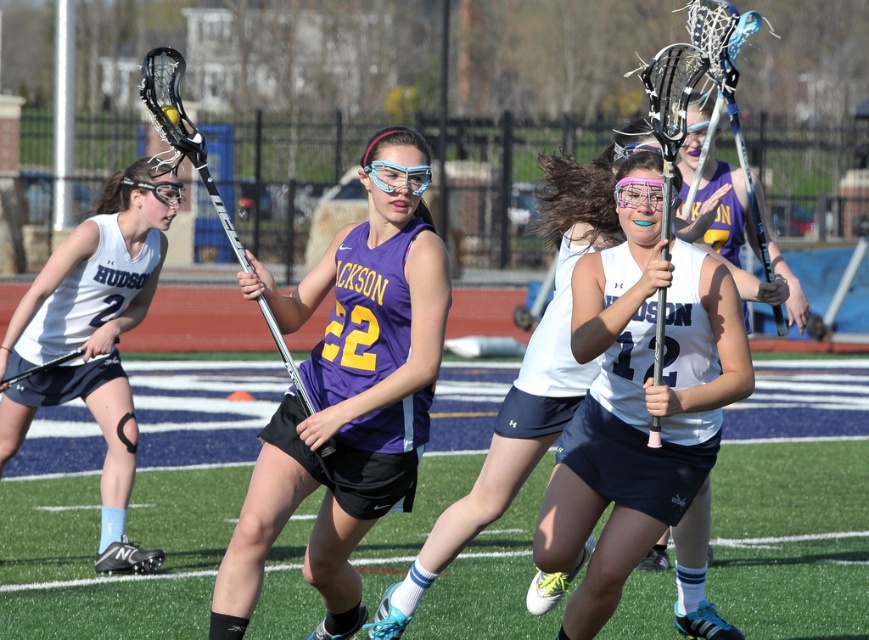
What do you see at coordinates (635, 413) in the screenshot? This screenshot has height=640, width=869. I see `white matte jersey at center` at bounding box center [635, 413].

Between point (731, 394) and point (634, 195), which one is positioned in front?

Point (731, 394) is in front.

Locate an element on the screen. The height and width of the screenshot is (640, 869). white matte jersey at center is located at coordinates (635, 413).

Who is shorter, transparent plastic goggles at center or clear plastic goggles at center?

transparent plastic goggles at center is shorter.

Is point (408, 186) farther from viewer compared to point (144, 186)?

No, (408, 186) is closer to viewer.

You are a GUI agent. You are given a task and a screenshot of the screen. Output one action in this format:
    pyautogui.click(x=<x>, y=<y>)
    Task: Click on the transparent plastic goggles at center
    
    Given the screenshot: What is the action you would take?
    click(x=397, y=177)

Who is shorter, purple matte lacrosse stick at center or white matte uniform at left?

purple matte lacrosse stick at center is shorter.

Who is more forward, (379, 342) or (116, 547)?

Positioned in front is point (379, 342).

Does point (410, 464) lie behind point (125, 388)?

No.

Where is `purple matte lacrosse stick at center`? The height and width of the screenshot is (640, 869). purple matte lacrosse stick at center is located at coordinates (346, 397).